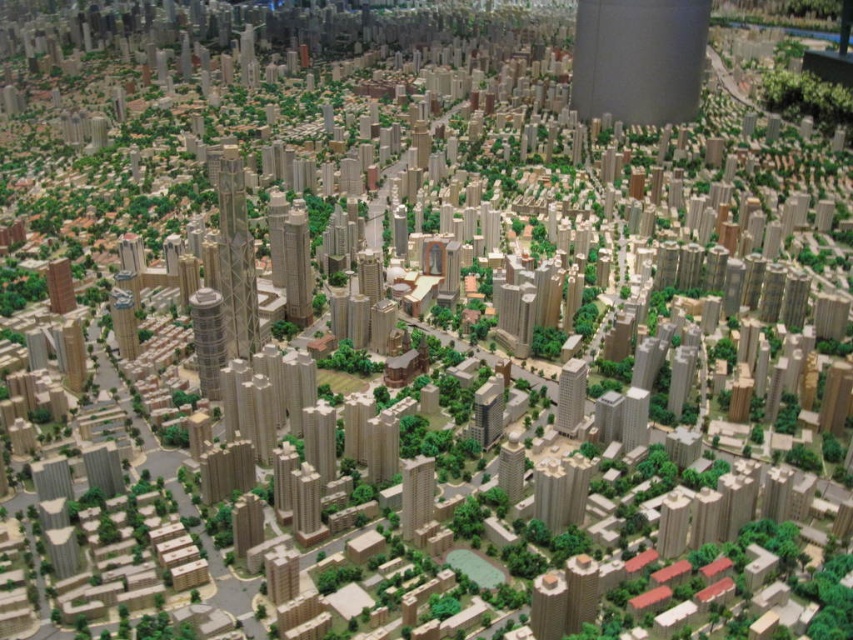
Question: Which object appears closest to the camera in this image?

Choices:
 (A) smooth gray tower at upper right
 (B) smooth beige skyscraper at center-left

Answer: (B)

Question: Is matte beige building at center closer to camera compared to matte beige skyscraper at center?

Choices:
 (A) yes
 (B) no

Answer: (A)

Question: Estimate the real-world distances between objects in this image. Which object is farther from the smooth beige skyscraper at center-left?

Choices:
 (A) beige concrete skyscraper at center
 (B) shiny silver skyscraper at center-left
 (C) matte beige skyscraper at center

Answer: (C)

Question: Which object is positioned closest to the smooth gray tower at upper right?

Choices:
 (A) shiny silver skyscraper at center-left
 (B) matte beige building at center
 (C) metallic glass skyscraper at center-left
 (D) matte brown building at left

Answer: (C)

Question: Does matte beige skyscraper at center have a lesser width compared to smooth beige skyscraper at center-left?

Choices:
 (A) no
 (B) yes

Answer: (B)

Question: Is smooth gray tower at upper right behind smooth beige skyscraper at center-left?

Choices:
 (A) yes
 (B) no

Answer: (A)